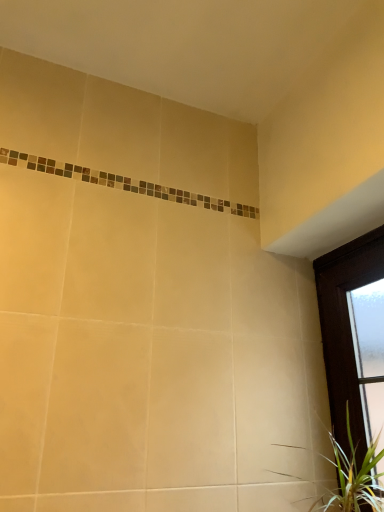
Question: Based on their positions, is dark wood window at right located to the left or right of green leafy plant at lower right?

Choices:
 (A) left
 (B) right

Answer: (B)

Question: From the image's perspective, is dark wood window at right above or below green leafy plant at lower right?

Choices:
 (A) above
 (B) below

Answer: (A)

Question: Based on their sizes in the image, would you say dark wood window at right is bigger or smaller than green leafy plant at lower right?

Choices:
 (A) small
 (B) big

Answer: (B)

Question: In the image, is green leafy plant at lower right positioned in front of or behind dark wood window at right?

Choices:
 (A) behind
 (B) front

Answer: (B)

Question: From their relative heights in the image, would you say green leafy plant at lower right is taller or shorter than dark wood window at right?

Choices:
 (A) short
 (B) tall

Answer: (A)

Question: From a real-world perspective, is green leafy plant at lower right positioned above or below dark wood window at right?

Choices:
 (A) above
 (B) below

Answer: (B)

Question: Do you think green leafy plant at lower right is within dark wood window at right, or outside of it?

Choices:
 (A) outside
 (B) inside

Answer: (B)